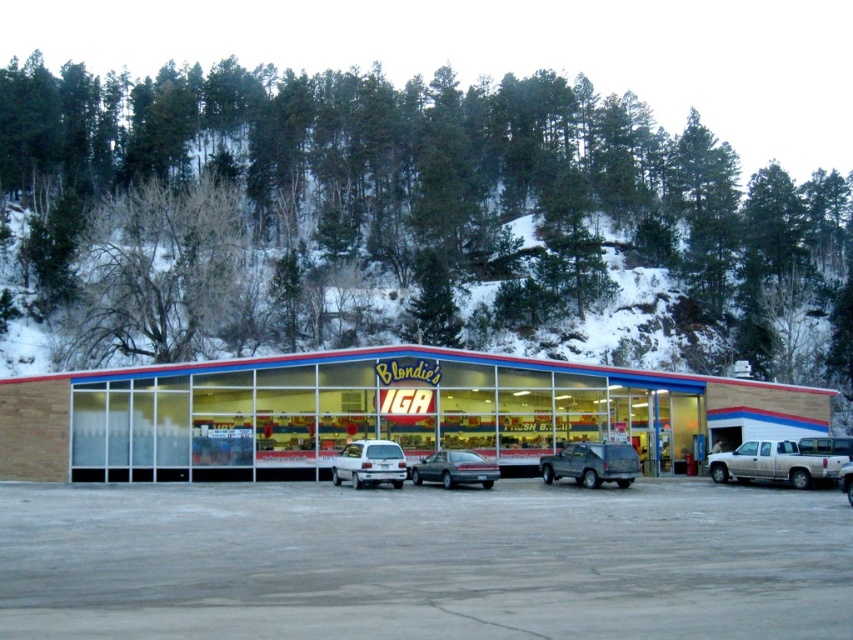
You are a delivery driver who needs to park your white matte truck at right in the parking lot near the wooden siding building at center. Considering the height difference between them, will the truck block the view of the building from the road?

The wooden siding building at center is much taller than the white matte truck at right, so parking the truck near it will not block the view of the building from the road.

You are standing at the entrance of Blondie IGA and want to move your white matte truck at right to the parking spot where the white matte hatchback at center is parked. Can you safely move the truck into that spot without needing to back out?

The white matte truck at right is 47.32 feet away from the white matte hatchback at center. Since the distance between them is quite large, you can safely move the truck into the spot without needing to back out.

You are standing at the entrance of the grocery store and want to locate the wooden siding building at center. According to the coordinates provided, where should you look relative to your current position?

The wooden siding building at center is located at coordinates point 0.645 on the x axis and 0.440 on the y axis relative to your current position at the entrance.